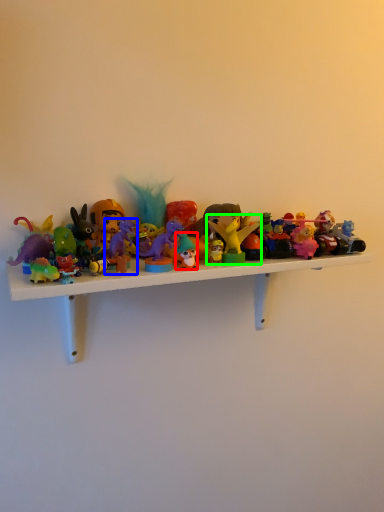
Question: Estimate the real-world distances between objects in this image. Which object is closer to toy (highlighted by a red box), toy (highlighted by a blue box) or toy (highlighted by a green box)?

Choices:
 (A) toy
 (B) toy

Answer: (B)